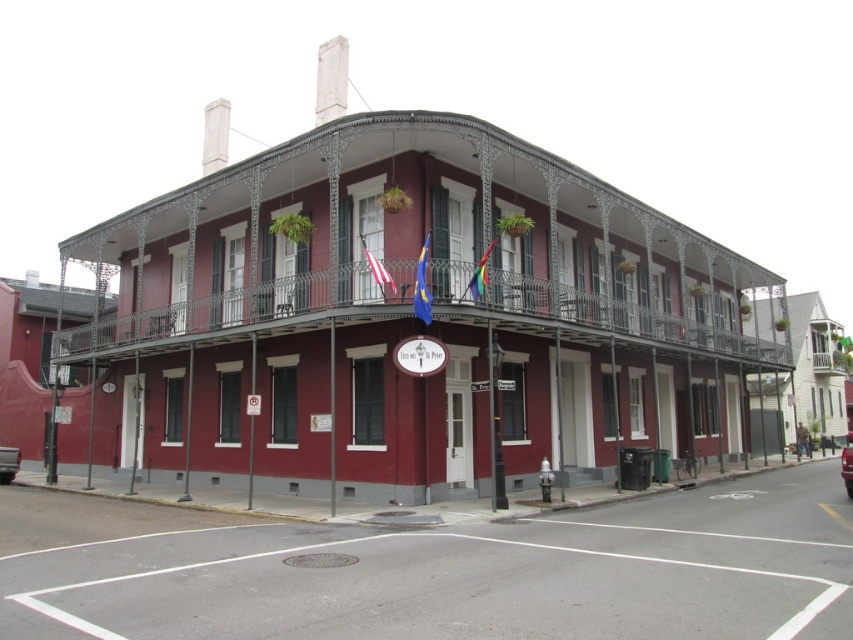
You are a visitor standing in front of the two flags displayed on the building. Which flag has a smaller width between the blue fabric flag at center and the white fabric flag at center?

The blue fabric flag at center has a lesser width compared to the white fabric flag at center.

You are standing in front of the two story building and see the blue fabric flag at center and the metallic silver truck at lower left. Which object is higher up from the ground?

The blue fabric flag at center is located above the metallic silver truck at lower left, so it is higher up from the ground.